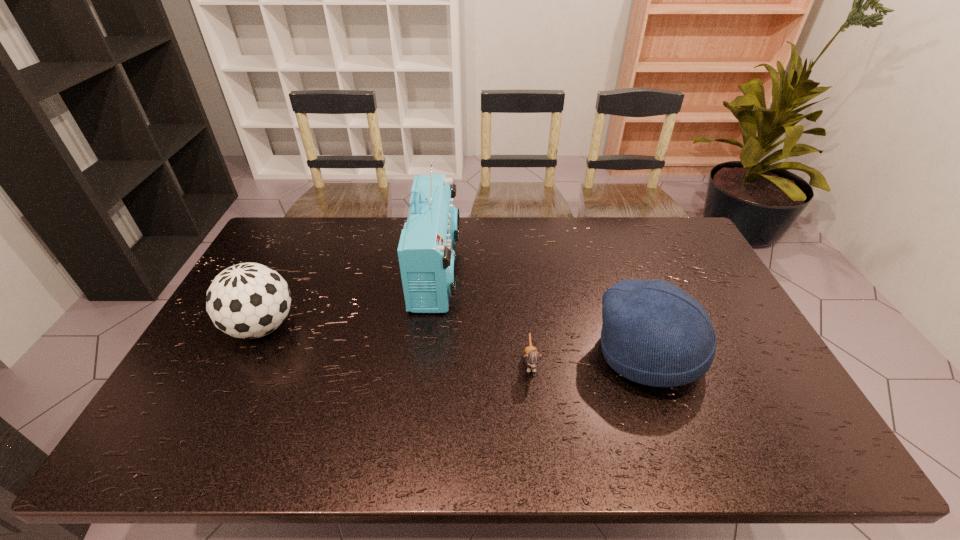
The width and height of the screenshot is (960, 540). In order to click on object positioned at the far edge in this screenshot , I will do `click(427, 261)`.

Where is `object that is at the left edge`? object that is at the left edge is located at coordinates (249, 300).

In order to click on object present at the right edge in this screenshot , I will do `click(654, 333)`.

You are a GUI agent. You are given a task and a screenshot of the screen. Output one action in this format:
    pyautogui.click(x=<x>, y=<y>)
    Task: Click on the vacant region at the far edge
    This screenshot has width=960, height=540.
    Given the screenshot: What is the action you would take?
    pyautogui.click(x=392, y=253)

Where is `vacant space at the near edge of the desktop`? This screenshot has height=540, width=960. vacant space at the near edge of the desktop is located at coordinates (267, 460).

The image size is (960, 540). In the image, there is a desktop. In order to click on vacant space at the far left corner in this screenshot , I will do coord(289,220).

Locate an element on the screen. vacant space at the near left corner is located at coordinates (218, 426).

Find the location of a particular element. The height and width of the screenshot is (540, 960). vacant region between the radio receiver and the shortest object is located at coordinates (484, 317).

Where is `blank region between the second object from left to right and the kitten`? blank region between the second object from left to right and the kitten is located at coordinates (484, 317).

Locate an element on the screen. Image resolution: width=960 pixels, height=540 pixels. vacant point located between the leftmost object and the second object from right to left is located at coordinates (396, 345).